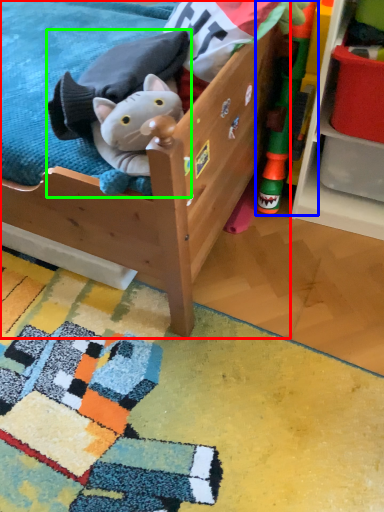
Question: Estimate the real-world distances between objects in this image. Which object is closer to furniture (highlighted by a red box), toy (highlighted by a blue box) or toy (highlighted by a green box)?

Choices:
 (A) toy
 (B) toy

Answer: (B)